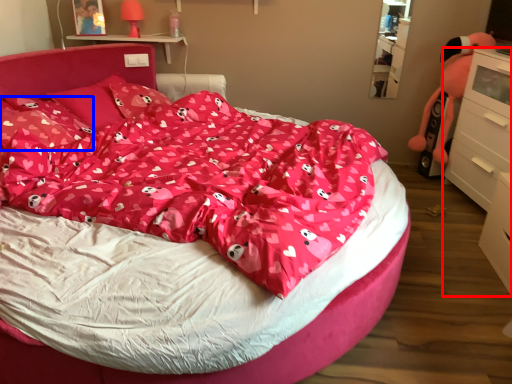
Question: Which of the following is the closest to the observer, chest of drawers (highlighted by a red box) or pillow (highlighted by a blue box)?

Choices:
 (A) chest of drawers
 (B) pillow

Answer: (B)